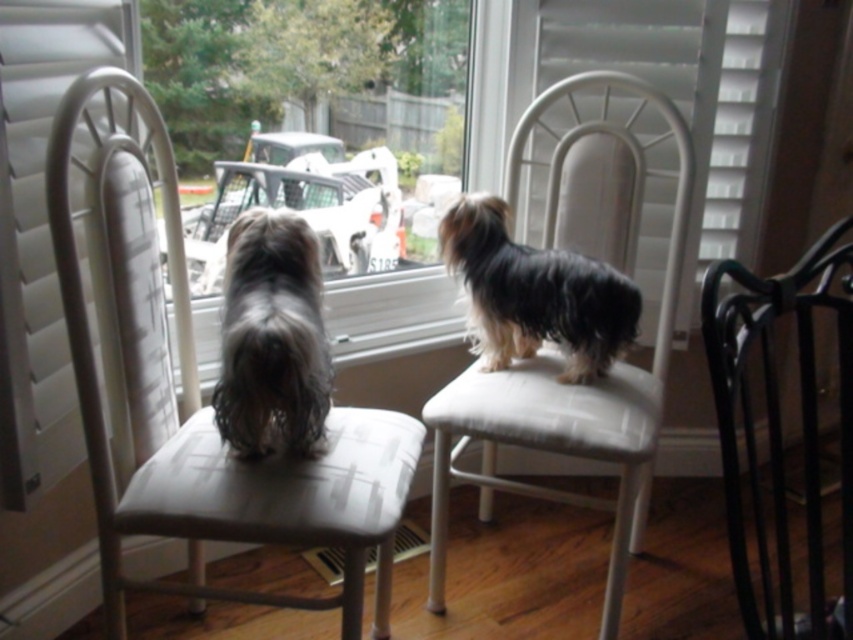
You are a dog owner who wants to place a small toy between the shaggy brown fur at left and the shiny black fur at center. Which dog will have the toy closer to its head?

The shaggy brown fur at left is taller than the shiny black fur at center, so the toy placed between them will be closer to the head of the shiny black fur at center.

You are a small toy measuring 10 inches in length. You want to move from the transparent glass window at center to the white fabric stool at center. Can you fit through the space between them?

The transparent glass window at center is 24.08 inches away from the white fabric stool at center. Since the toy is only 10 inches long, there is enough space for it to move between them.